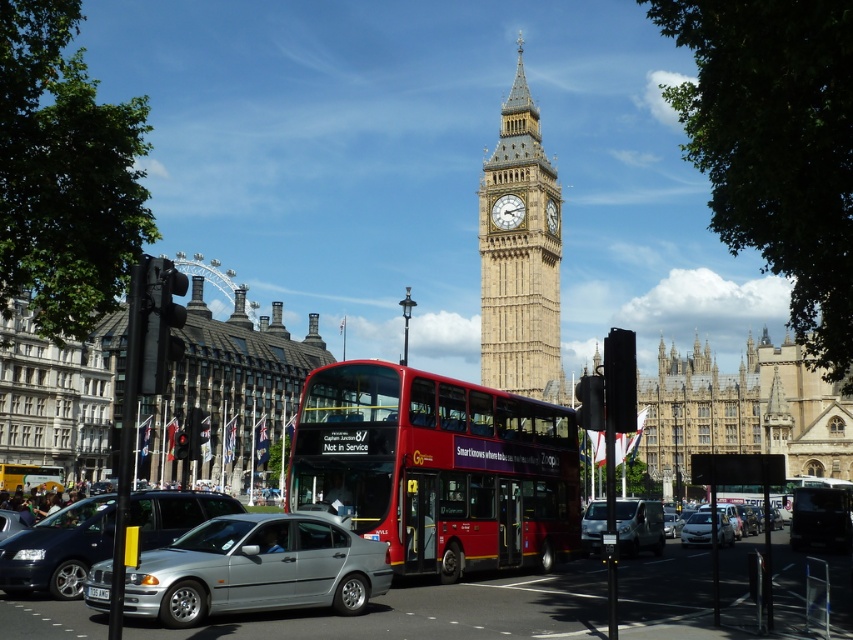
Is red metallic bus at center positioned before silver metallic sedan at center?

That is False.

Is red metallic bus at center below silver metallic sedan at center?

No, red metallic bus at center is not below silver metallic sedan at center.

The width and height of the screenshot is (853, 640). I want to click on red metallic bus at center, so click(437, 468).

Between silver metallic van at center and white plastic license plate at center, which one is positioned lower?

white plastic license plate at center is below.

Does point (660, 529) come in front of point (88, 588)?

No, (660, 529) is further to viewer.

Is point (601, 518) closer to viewer compared to point (97, 596)?

No, it is behind (97, 596).

Where is `silver metallic van at center`? silver metallic van at center is located at coordinates (639, 525).

Who is higher up, red metallic bus at center or white plastic license plate at center?

red metallic bus at center is higher up.

Does red metallic bus at center have a smaller size compared to white plastic license plate at center?

Incorrect, red metallic bus at center is not smaller in size than white plastic license plate at center.

The image size is (853, 640). What do you see at coordinates (437, 468) in the screenshot?
I see `red metallic bus at center` at bounding box center [437, 468].

At what (x,y) coordinates should I click in order to perform the action: click on red metallic bus at center. Please return your answer as a coordinate pair (x, y). Looking at the image, I should click on (437, 468).